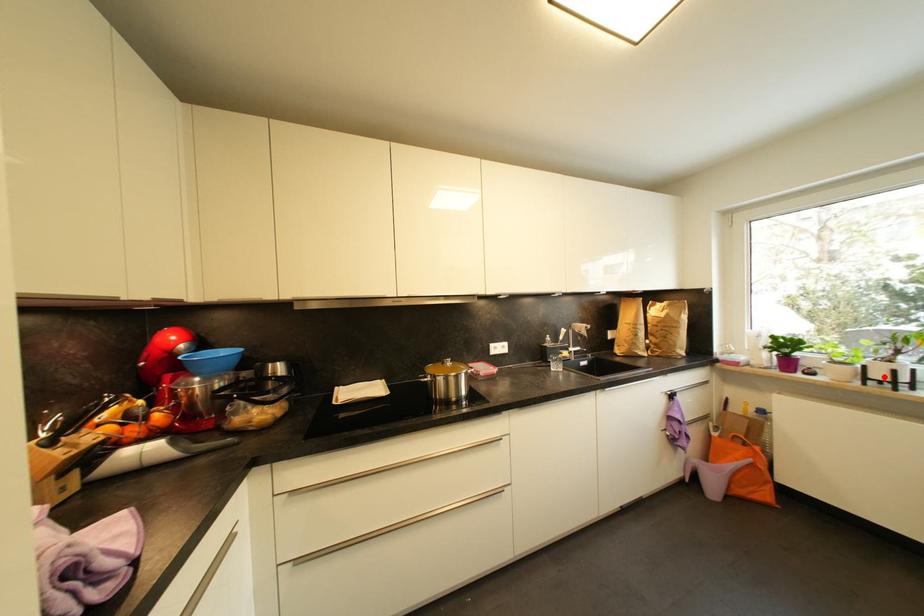
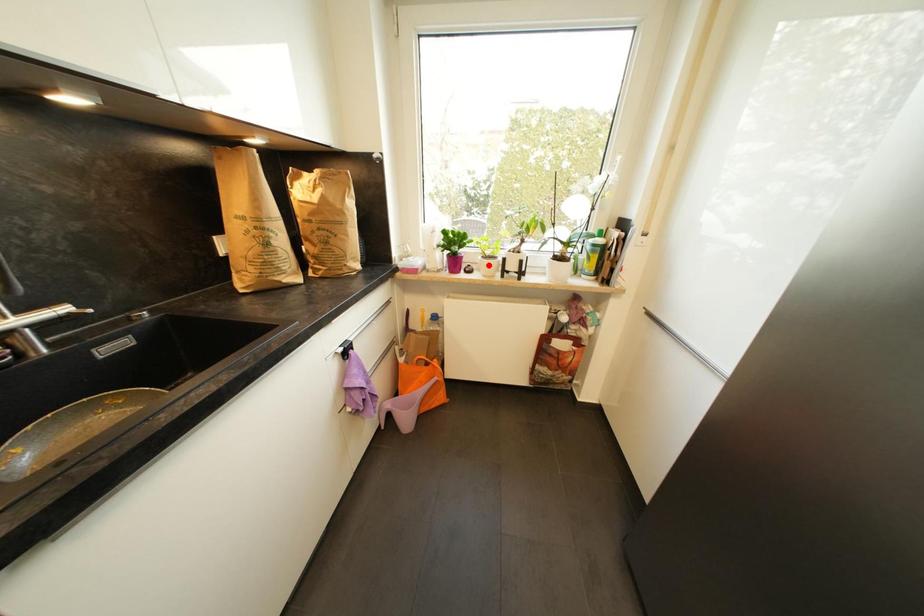
I am providing you with two images of the same scene from different viewpoints. A red point is marked on the first image and another point is marked on the second image. Does the point marked in image1 correspond to the same location as the one in image2?

No